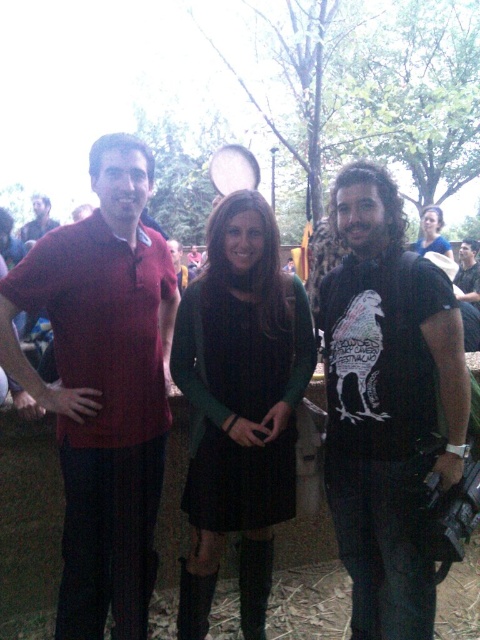
Is matte red polo shirt at left further to camera compared to matte black dress at center?

No, it is in front of matte black dress at center.

Is matte red polo shirt at left to the right of matte black dress at center from the viewer's perspective?

In fact, matte red polo shirt at left is to the left of matte black dress at center.

Who is more distant from viewer, [137,556] or [447,250]?

Positioned behind is point [447,250].

The width and height of the screenshot is (480, 640). I want to click on matte red polo shirt at left, so click(x=104, y=387).

Can you confirm if matte green sweater at center is smaller than matte black shirt at center?

Yes.

Which of these two, matte green sweater at center or matte black shirt at center, stands shorter?

matte black shirt at center

Is point (300, 289) closer to viewer compared to point (463, 256)?

Yes, point (300, 289) is closer to viewer.

Identify the location of matte green sweater at center. The width and height of the screenshot is (480, 640). (240, 406).

Identify the location of matte black shirt at center. (468, 272).

Describe the element at coordinates (468, 272) in the screenshot. I see `matte black shirt at center` at that location.

Where is `matte black shirt at center`? The image size is (480, 640). matte black shirt at center is located at coordinates click(x=468, y=272).